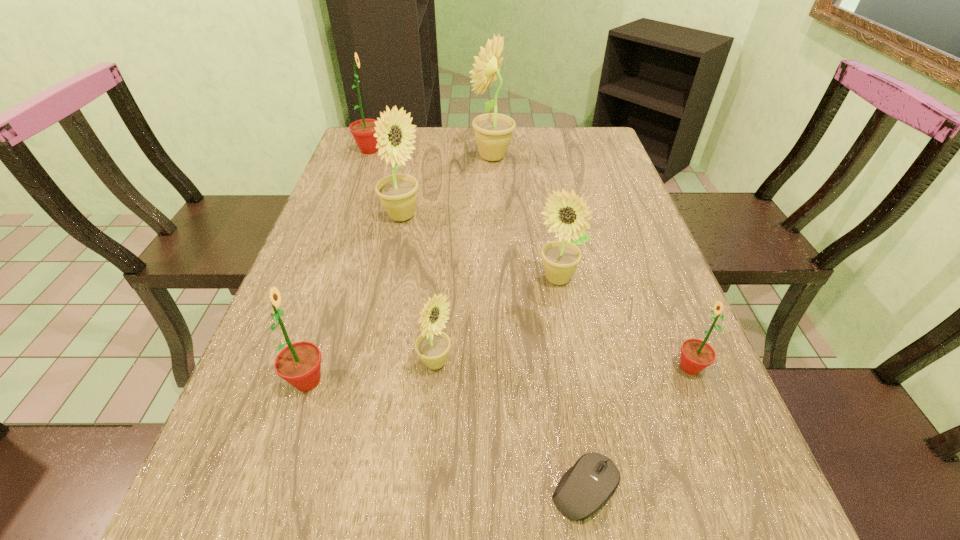
You are a GUI agent. You are given a task and a screenshot of the screen. Output one action in this format:
    pyautogui.click(x=<x>, y=<y>)
    Task: Click on the smallest green sunflower
    
    Given the screenshot: What is the action you would take?
    pyautogui.click(x=696, y=355)

At what (x,y) coordinates should I click in order to perform the action: click on the rightmost object. Please return your answer as a coordinate pair (x, y). The image size is (960, 540). Looking at the image, I should click on (696, 355).

At what (x,y) coordinates should I click in order to perform the action: click on black computer equipment. Please return your answer as a coordinate pair (x, y). This screenshot has width=960, height=540. Looking at the image, I should click on (584, 488).

I want to click on the nearest object, so click(584, 488).

Find the location of a particular element. Image resolution: width=960 pixels, height=540 pixels. free space located 0.280m on the face of the biggest yellow sunflower is located at coordinates (383, 157).

This screenshot has width=960, height=540. I want to click on vacant point located on the face of the biggest yellow sunflower, so click(396, 157).

Identify the location of free space located on the face of the biggest yellow sunflower. This screenshot has width=960, height=540. 398,157.

I want to click on vacant space situated on the face of the sixth object from right to left, so click(521, 217).

What are the coordinates of `vacant space located on the face of the farthest green sunflower` in the screenshot? It's located at (474, 150).

Identify the location of vacant space located 0.060m on the face of the second biggest green sunflower. (362, 381).